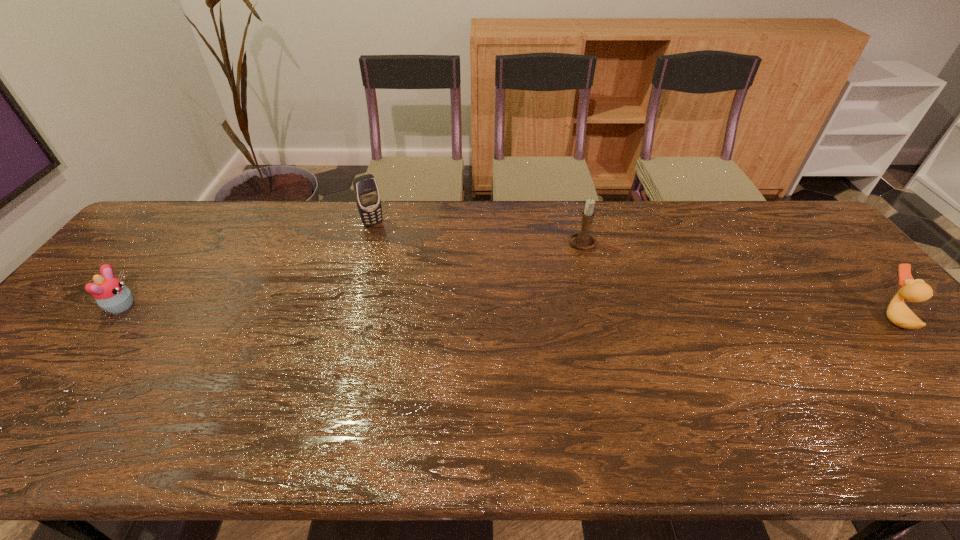
In the image, there is a desktop. Where is `blank space at the far edge`? blank space at the far edge is located at coordinates (520, 231).

Locate an element on the screen. vacant space at the near edge is located at coordinates (833, 389).

The image size is (960, 540). What are the coordinates of `free space at the left edge of the desktop` in the screenshot? It's located at (36, 369).

You are a GUI agent. You are given a task and a screenshot of the screen. Output one action in this format:
    pyautogui.click(x=<x>, y=<y>)
    Task: Click on the vacant region at the far left corner of the desktop
    This screenshot has height=540, width=960.
    Given the screenshot: What is the action you would take?
    pyautogui.click(x=179, y=209)

Where is `vacant space at the near left corner of the desktop`? The width and height of the screenshot is (960, 540). vacant space at the near left corner of the desktop is located at coordinates (27, 377).

The height and width of the screenshot is (540, 960). I want to click on vacant space at the far right corner of the desktop, so click(828, 244).

You are a GUI agent. You are given a task and a screenshot of the screen. Output one action in this format:
    pyautogui.click(x=<x>, y=<y>)
    Task: Click on the free spot between the duck and the cellular telephone
    
    Given the screenshot: What is the action you would take?
    pyautogui.click(x=633, y=271)

Where is `vacant area between the duck and the cellular telephone`? The image size is (960, 540). vacant area between the duck and the cellular telephone is located at coordinates (633, 271).

The image size is (960, 540). What are the coordinates of `free spot between the second farthest object and the cellular telephone` in the screenshot? It's located at [477, 233].

Identify the location of free space that is in between the cupcake and the rightmost object. This screenshot has width=960, height=540. (507, 312).